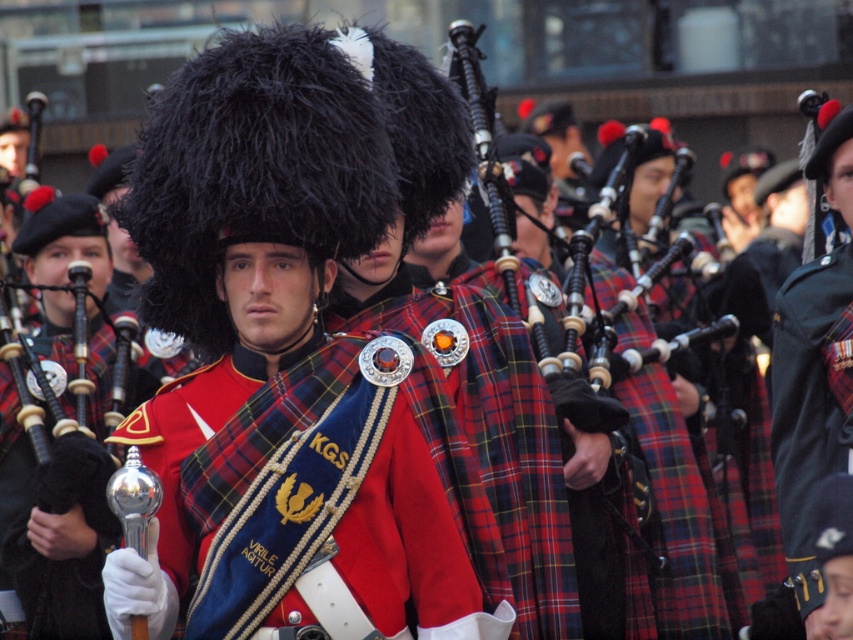
You are a photographer trying to capture a closeup of the bagpipe held by the central figure. You have two points marked in the image to focus on. Which point, point (407, 458) or point (509, 278), is closer to the bagpipe?

Point (407, 458) is closer to the viewer than point (509, 278), so it is closer to the bagpipe.

You are a costume designer working on a historical drama. You need to ensure that the red plaid sash at center and the green fabric uniform at center are proportionally accurate. Based on the image, which object is shorter?

The red plaid sash at center is shorter than the green fabric uniform at center.

You are a photographer at the event and want to capture a closeup of the red plaid sash at center and the wooden bagpipe at center. Which object should you focus on first if you want to ensure both are in focus, given that the camera can only focus on one object at a time?

The red plaid sash at center is positioned on the left side of wooden bagpipe at center, so focusing on the red plaid sash at center first would ensure both are in focus since it is closer to the camera.